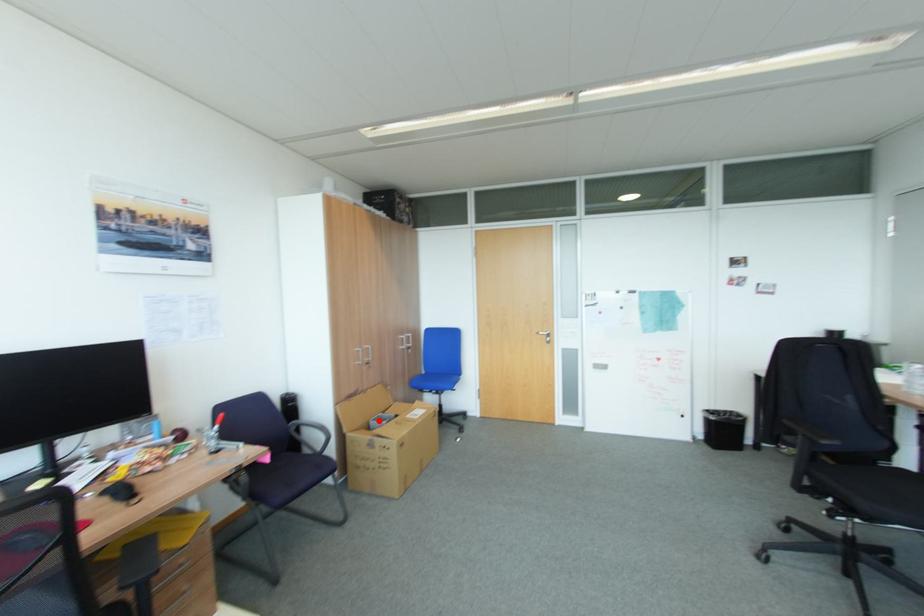
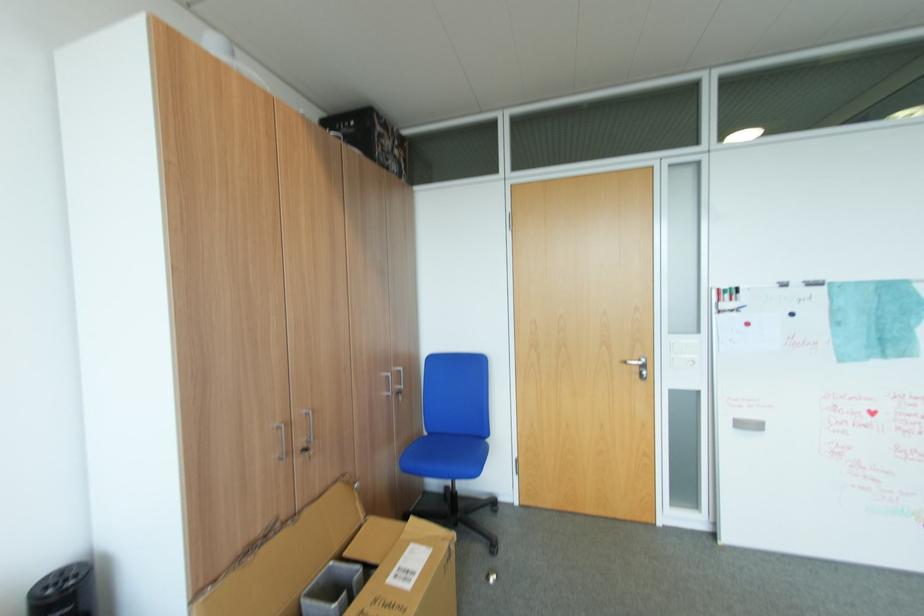
Question: I am providing you with two images of the same scene from different viewpoints. A red point is marked on the first image. Is the red point's position out of view in image 2?

Choices:
 (A) Yes
 (B) No

Answer: (B)